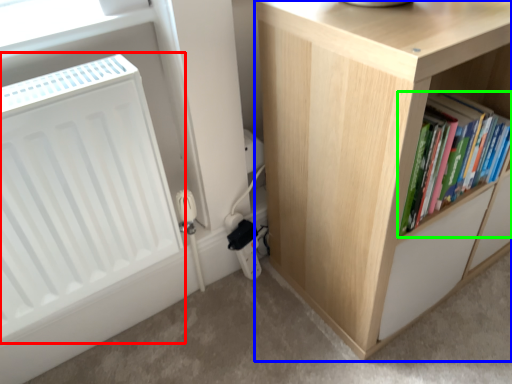
Question: Which is nearer to the radiator (highlighted by a red box)? cupboard (highlighted by a blue box) or book (highlighted by a green box).

Choices:
 (A) cupboard
 (B) book

Answer: (A)